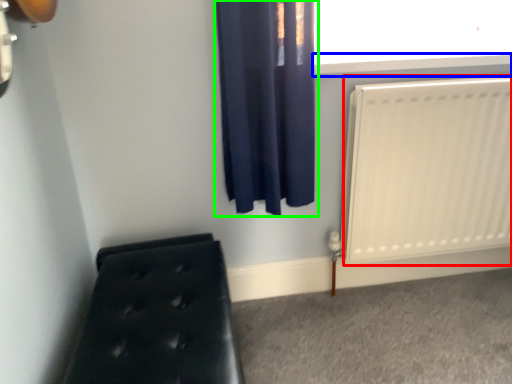
Question: Considering the real-world distances, which object is farthest from radiator (highlighted by a red box)? window sill (highlighted by a blue box) or curtain (highlighted by a green box)?

Choices:
 (A) window sill
 (B) curtain

Answer: (B)